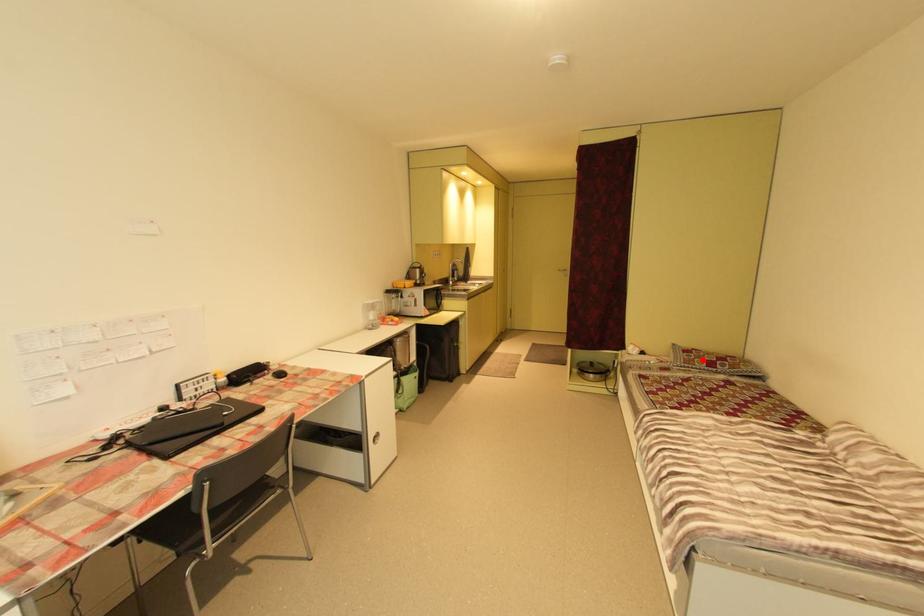
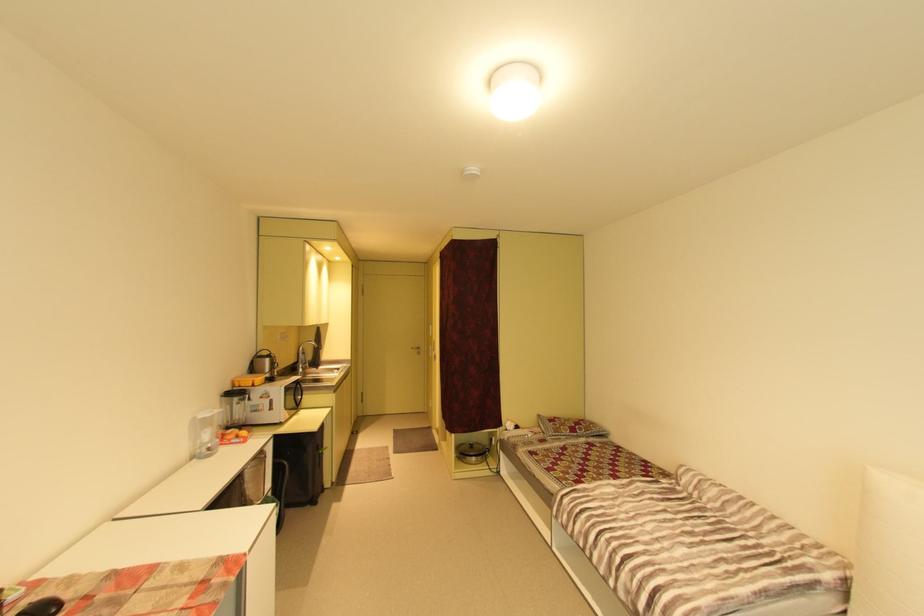
The point at the highlighted location is marked in the first image. Where is the corresponding point in the second image?

(568, 428)